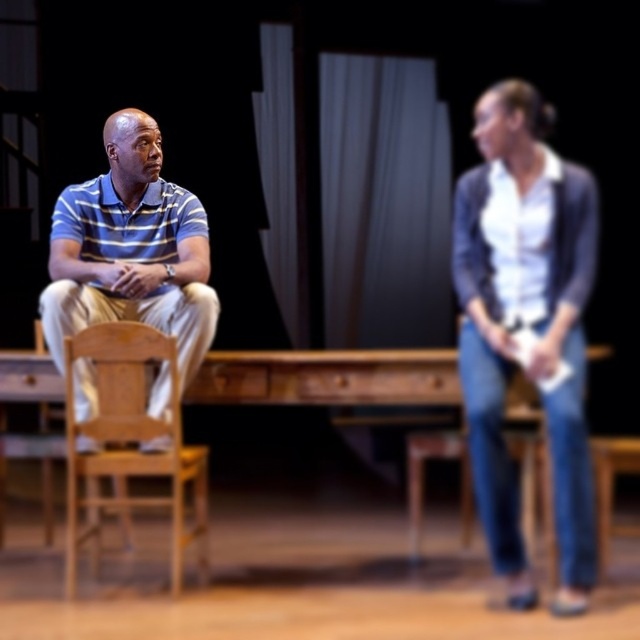
Question: Estimate the real-world distances between objects in this image. Which object is farther from the white cotton shirt at right?

Choices:
 (A) wooden chair at left
 (B) white fabric curtain at center

Answer: (B)

Question: Which object appears closest to the camera in this image?

Choices:
 (A) wooden chair at left
 (B) striped polo shirt at left
 (C) white cotton shirt at right

Answer: (C)

Question: Is wooden chair at left thinner than white fabric curtain at center?

Choices:
 (A) no
 (B) yes

Answer: (A)

Question: Can you confirm if white cotton shirt at right is positioned to the left of striped polo shirt at left?

Choices:
 (A) no
 (B) yes

Answer: (A)

Question: Is white cotton shirt at right bigger than white fabric curtain at center?

Choices:
 (A) yes
 (B) no

Answer: (A)

Question: Which object is farther from the camera taking this photo?

Choices:
 (A) striped polo shirt at left
 (B) white cotton shirt at right

Answer: (A)